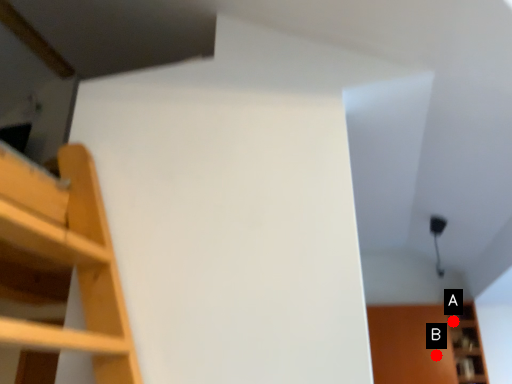
Question: Two points are circled on the image, labeled by A and B beside each circle. Among these points, which one is nearest to the camera?

Choices:
 (A) A is closer
 (B) B is closer

Answer: (B)